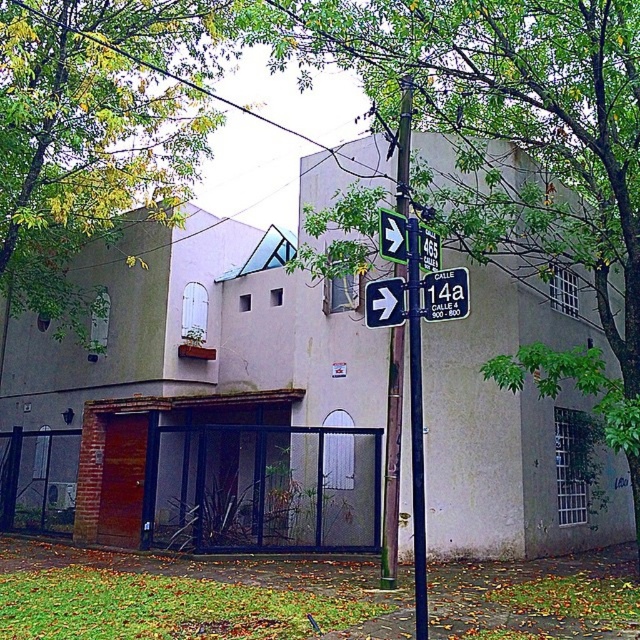
You are standing at the street corner and see the building with a unique architectural design. There is a point marked at coordinates (506, 122). What object does this point correspond to in the scene?

The point at coordinates (506, 122) corresponds to the green leafy tree at center.

You are standing at the street corner and want to determine the relative positions of two points marked on the building facade. Which point, point (417, 49) or point (224, 10), is closer to you?

Point (417, 49) is closer to the viewer than point (224, 10).

You are a delivery driver who needs to see both the white plastic sign at center and the black plastic street sign at center clearly while driving past them. Which sign will appear larger in your view?

The white plastic sign at center appears larger because it is much taller than the black plastic street sign at center.